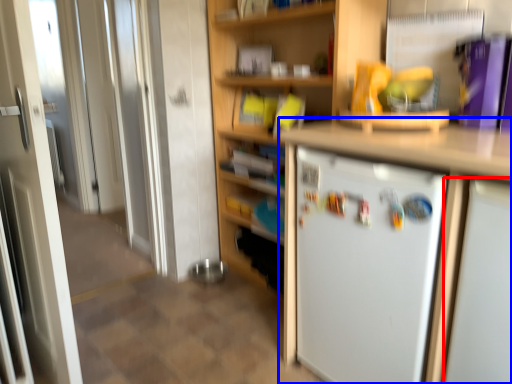
Question: Which object appears closest to the camera in this image, appliance (highlighted by a red box) or cabinetry (highlighted by a blue box)?

Choices:
 (A) appliance
 (B) cabinetry

Answer: (A)